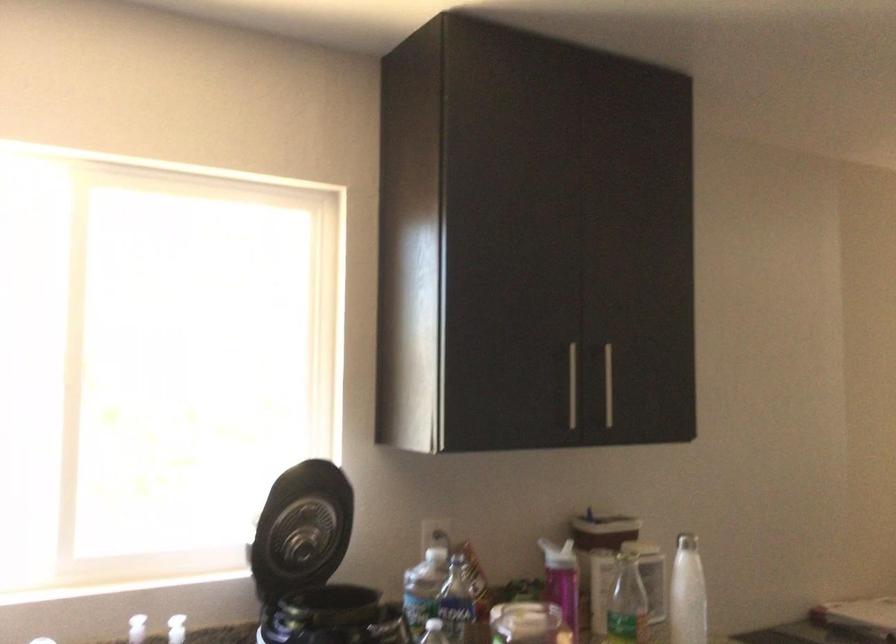
This screenshot has height=644, width=896. What do you see at coordinates (687, 592) in the screenshot?
I see `the plastic water bottle` at bounding box center [687, 592].